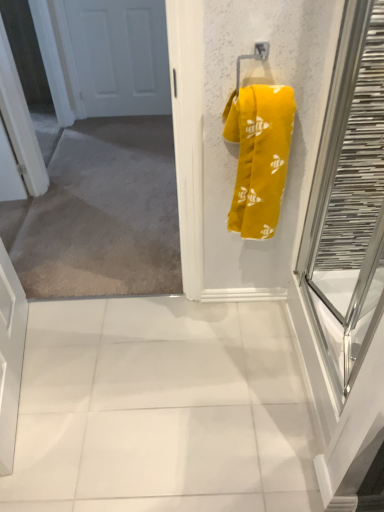
Where is `clear glass door at right`? clear glass door at right is located at coordinates (348, 201).

Locate an element on the screen. yellow fabric towel at upper right is located at coordinates coord(259,156).

Which object is positioned more to the left, yellow fabric towel at upper right or white matte door at upper left?

Positioned to the left is white matte door at upper left.

Considering the sizes of objects yellow fabric towel at upper right and white matte door at upper left in the image provided, who is bigger, yellow fabric towel at upper right or white matte door at upper left?

yellow fabric towel at upper right.

Consider the image. From the image's perspective, is yellow fabric towel at upper right below white matte door at upper left?

Yes, from the image's perspective, yellow fabric towel at upper right is beneath white matte door at upper left.

Considering the positions of point (254, 212) and point (84, 70), is point (254, 212) closer or farther from the camera than point (84, 70)?

Clearly, point (254, 212) is closer to the camera than point (84, 70).

Is clear glass door at right behind white matte door at upper left?

No, clear glass door at right is closer to the viewer.

Is point (372, 227) positioned after point (93, 37)?

No, (372, 227) is closer to viewer.

From a real-world perspective, is clear glass door at right physically above white matte door at upper left?

Yes, from a real-world perspective, clear glass door at right is above white matte door at upper left.

Which is correct: clear glass door at right is inside white matte door at upper left, or outside of it?

clear glass door at right is spatially situated outside white matte door at upper left.

Considering the relative sizes of white matte door at upper left and yellow fabric towel at upper right in the image provided, is white matte door at upper left shorter than yellow fabric towel at upper right?

No, white matte door at upper left is not shorter than yellow fabric towel at upper right.

Considering the positions of objects white matte door at upper left and yellow fabric towel at upper right in the image provided, who is in front, white matte door at upper left or yellow fabric towel at upper right?

yellow fabric towel at upper right is closer to the camera.

Looking at the image, does white matte door at upper left seem bigger or smaller compared to yellow fabric towel at upper right?

white matte door at upper left is smaller than yellow fabric towel at upper right.

Between point (113, 2) and point (246, 179), which one is positioned in front?

The point (246, 179) is more forward.

Is white matte door at upper left facing towards white glossy tile at center?

Yes, white matte door at upper left is oriented towards white glossy tile at center.

Which point is more forward, (100, 71) or (268, 415)?

Positioned in front is point (268, 415).

Are white matte door at upper left and white glossy tile at center beside each other?

They are not placed beside each other.

From the picture: Is white glossy tile at center not near clear glass door at right?

No.

Is white glossy tile at center to the left of clear glass door at right from the viewer's perspective?

Correct, you'll find white glossy tile at center to the left of clear glass door at right.

How many degrees apart are the facing directions of white glossy tile at center and clear glass door at right?

89.9 degrees.

Is white glossy tile at center in front of or behind clear glass door at right in the image?

white glossy tile at center is behind clear glass door at right.

From a real-world perspective, is white glossy tile at center under white matte door at upper left?

Yes.

Consider the image. Between white glossy tile at center and white matte door at upper left, which one has larger width?

Wider between the two is white glossy tile at center.

Is white glossy tile at center positioned with its back to white matte door at upper left?

white glossy tile at center is not turned away from white matte door at upper left.

You are a GUI agent. You are given a task and a screenshot of the screen. Output one action in this format:
    pyautogui.click(x=<x>, y=<y>)
    Task: Click on the tile in front of the white matte door at upper left
    
    Given the screenshot: What is the action you would take?
    pyautogui.click(x=162, y=409)

From a real-world perspective, is yellow fabric towel at upper right located beneath clear glass door at right?

No, from a real-world perspective, yellow fabric towel at upper right is not under clear glass door at right.

From the image's perspective, between yellow fabric towel at upper right and clear glass door at right, which one is located above?

From the image's view, yellow fabric towel at upper right is above.

Which point is more forward, (242, 192) or (341, 56)?

Positioned in front is point (341, 56).

Is yellow fabric towel at upper right positioned with its back to clear glass door at right?

No, yellow fabric towel at upper right is not facing the opposite direction of clear glass door at right.

Find the location of a particular element. This screenshot has height=512, width=384. door below the yellow fabric towel at upper right (from a real-world perspective) is located at coordinates (117, 56).

The width and height of the screenshot is (384, 512). Identify the location of door to the left of clear glass door at right. (117, 56).

Based on their spatial positions, is clear glass door at right or white glossy tile at center further from yellow fabric towel at upper right?

white glossy tile at center is positioned further to the anchor yellow fabric towel at upper right.

When comparing their distances from yellow fabric towel at upper right, does clear glass door at right or white matte door at upper left seem further?

white matte door at upper left is positioned further to the anchor yellow fabric towel at upper right.

When comparing their distances from yellow fabric towel at upper right, does white matte door at upper left or clear glass door at right seem further?

Based on the image, white matte door at upper left appears to be further to yellow fabric towel at upper right.

Based on their spatial positions, is yellow fabric towel at upper right or white glossy tile at center closer to clear glass door at right?

The object closer to clear glass door at right is yellow fabric towel at upper right.

From the image, which object appears to be farther from white matte door at upper left, yellow fabric towel at upper right or clear glass door at right?

clear glass door at right is further to white matte door at upper left.

Estimate the real-world distances between objects in this image. Which object is closer to white matte door at upper left, clear glass door at right or yellow fabric towel at upper right?

yellow fabric towel at upper right is positioned closer to the anchor white matte door at upper left.

Considering their positions, is white glossy tile at center positioned further to clear glass door at right than yellow fabric towel at upper right?

white glossy tile at center is positioned further to the anchor clear glass door at right.

Which object lies further to the anchor point clear glass door at right, yellow fabric towel at upper right or white matte door at upper left?

white matte door at upper left is further to clear glass door at right.

Locate an element on the screen. Image resolution: width=384 pixels, height=512 pixels. towel between clear glass door at right and white matte door at upper left in the front-back direction is located at coordinates (259, 156).

Image resolution: width=384 pixels, height=512 pixels. In order to click on tile between clear glass door at right and white matte door at upper left along the z-axis in this screenshot , I will do `click(162, 409)`.

Locate an element on the screen. The width and height of the screenshot is (384, 512). towel between white matte door at upper left and white glossy tile at center vertically is located at coordinates (259, 156).

At what (x,y) coordinates should I click in order to perform the action: click on glass door that lies between yellow fabric towel at upper right and white glossy tile at center from top to bottom. Please return your answer as a coordinate pair (x, y). The width and height of the screenshot is (384, 512). Looking at the image, I should click on (348, 201).